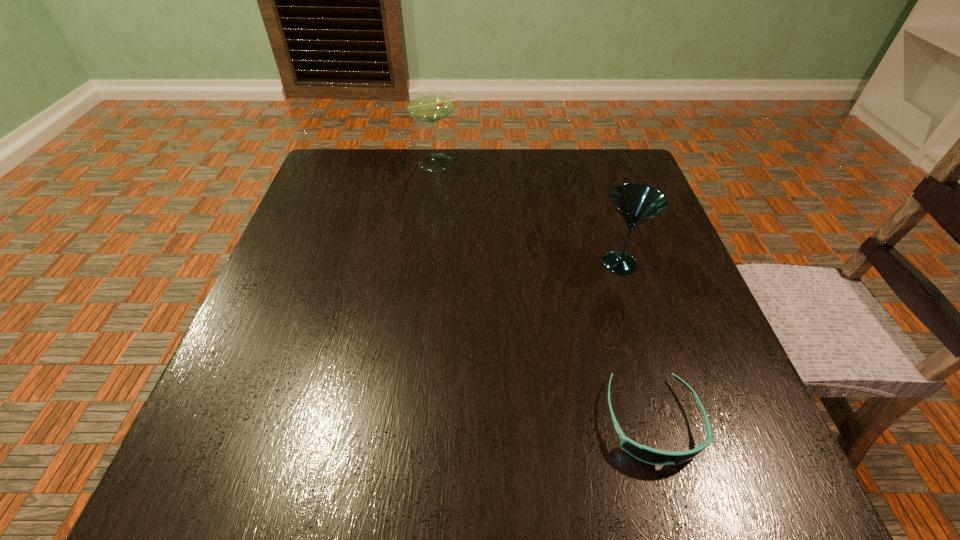
Where is `martini present at the right edge`? This screenshot has height=540, width=960. martini present at the right edge is located at coordinates (636, 203).

This screenshot has height=540, width=960. I want to click on sunglasses that is at the right edge, so click(643, 453).

You are a GUI agent. You are given a task and a screenshot of the screen. Output one action in this format:
    pyautogui.click(x=<x>, y=<y>)
    Task: Click on the object present at the near right corner
    
    Given the screenshot: What is the action you would take?
    pyautogui.click(x=643, y=453)

Find the location of `free location at the far edge of the desktop`. free location at the far edge of the desktop is located at coordinates (434, 177).

Find the location of `vacant region at the near edge of the desktop`. vacant region at the near edge of the desktop is located at coordinates (633, 496).

Locate an element on the screen. vacant area at the left edge of the desktop is located at coordinates (333, 295).

Where is `vacant space at the right edge`? This screenshot has width=960, height=540. vacant space at the right edge is located at coordinates (623, 227).

Find the location of `vacant position at the far left corner of the desktop`. vacant position at the far left corner of the desktop is located at coordinates (324, 194).

Locate an element on the screen. vacant area at the far right corner of the desktop is located at coordinates (584, 190).

Locate an element on the screen. unoccupied area between the second tallest object and the farther martini is located at coordinates (528, 213).